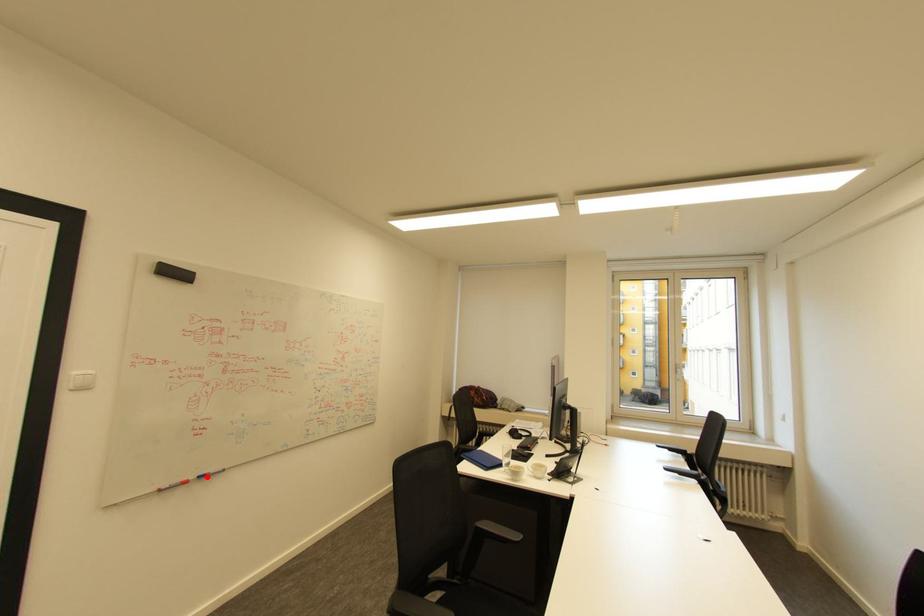
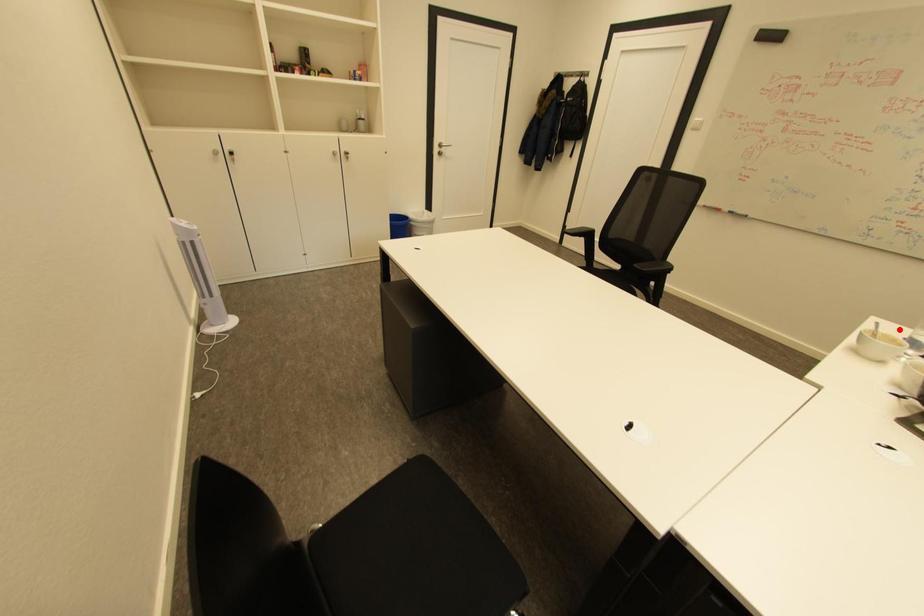
I am providing you with two images of the same scene from different viewpoints. A red point is marked on the first image and another point is marked on the second image. Do the highlighted points in image1 and image2 indicate the same real-world spot?

No